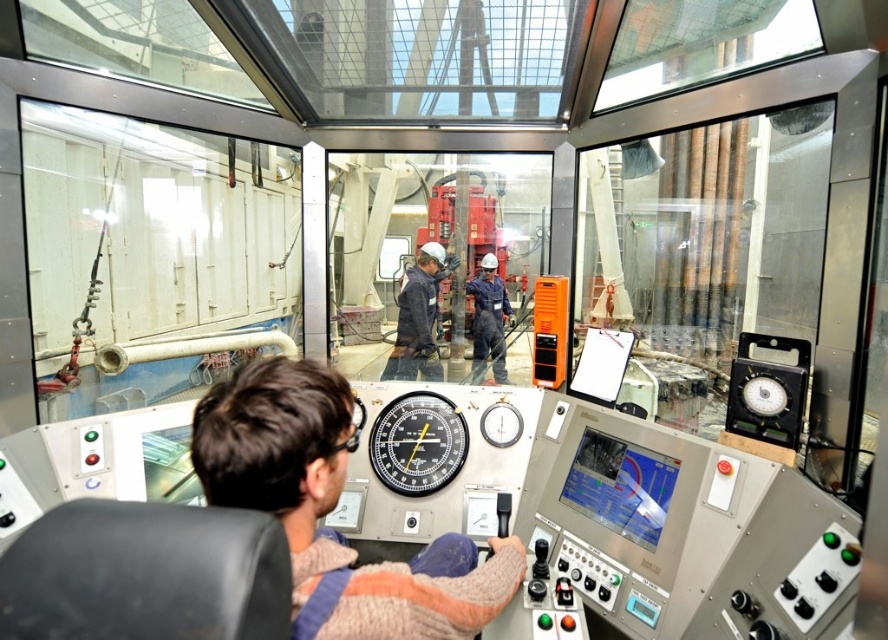
Does point (407, 611) lie in front of point (486, 298)?

Yes, it is.

Which is below, knitted sweater at center or blue uniform at center?

knitted sweater at center is lower down.

Is point (223, 504) behind point (480, 344)?

That is False.

Find the location of a particular element. knitted sweater at center is located at coordinates (329, 508).

Between knitted sweater at center and dark blue jeans at center, which one has less height?

knitted sweater at center is shorter.

You are a GUI agent. You are given a task and a screenshot of the screen. Output one action in this format:
    pyautogui.click(x=<x>, y=<y>)
    Task: Click on the knitted sweater at center
    
    Given the screenshot: What is the action you would take?
    pyautogui.click(x=329, y=508)

Which is behind, point (383, 432) or point (416, 337)?

Positioned behind is point (416, 337).

Describe the element at coordinates (417, 444) in the screenshot. I see `black plastic gauge at center` at that location.

Locate an element on the screen. The image size is (888, 640). black plastic gauge at center is located at coordinates (417, 444).